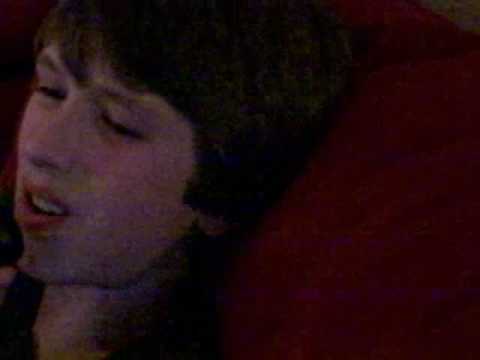
You are a GUI agent. You are given a task and a screenshot of the screen. Output one action in this format:
    pyautogui.click(x=<x>, y=<y>)
    Task: Click on the couch
    This screenshot has width=480, height=360.
    Given the screenshot: What is the action you would take?
    pyautogui.click(x=426, y=257)